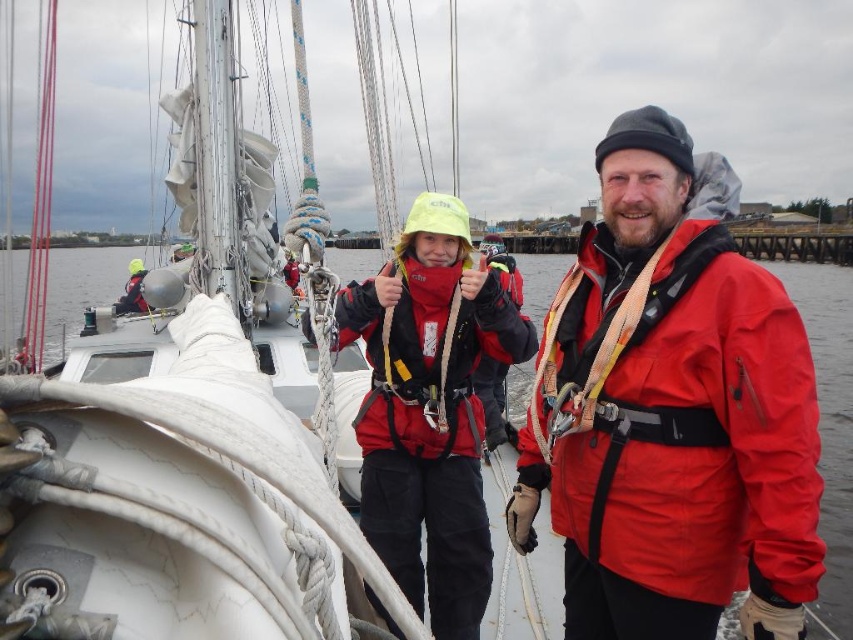
You are a sailor on the deck of the white matte sailboat at upper center and need to reach the matte black jacket at center. Given the height difference between the two, can you comfortably step down from the sailboat to the jacket without needing a ladder?

The white matte sailboat at upper center is shorter than the matte black jacket at center. Therefore, you can comfortably step down from the sailboat to the jacket without needing a ladder.

You are a photographer trying to capture both the matte red jacket at center and the matte black jacket at center in a single frame. Given their sizes, which jacket will appear smaller in the photo?

The matte red jacket at center will appear smaller in the photo because it has a lesser width compared to the matte black jacket at center.